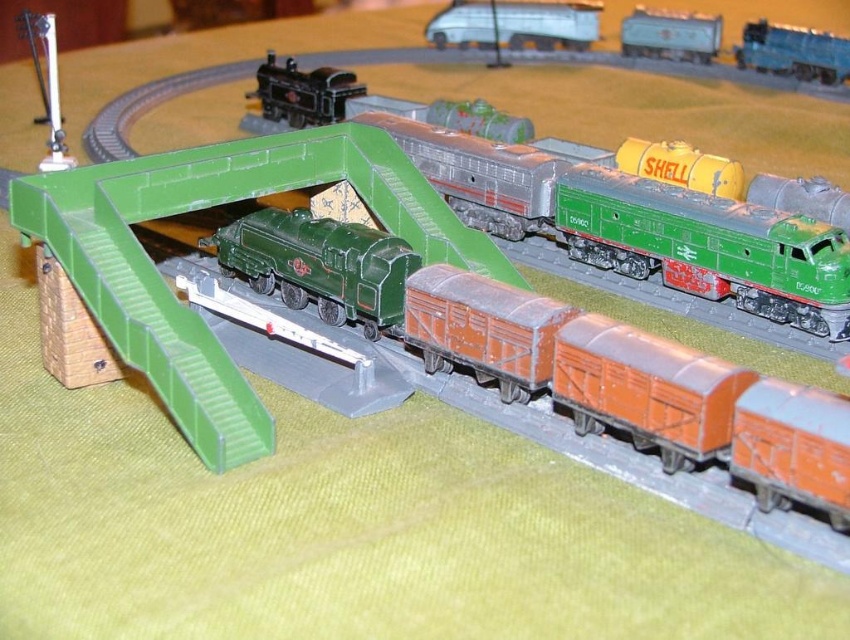
You are a model train enthusiast examining the miniature railway diorama. You notice two points marked on the image. Which point, point (592, 19) or point (756, 32), is closer to you?

Point (592, 19) is closer to you because it is further to the viewer than point (756, 32).

You are a model train enthusiast who wants to place both the green matte train at center and the green matte locomotive at center on a shelf. The shelf has a height limit of 12 inches. Can both items fit on the shelf without exceeding the height restriction?

The green matte train at center is taller than the green matte locomotive at center. Since the shelf has a height limit of 12 inches, both items can fit as long as the tallest item, the green matte train at center, is under 12 inches in height.

You are a model train enthusiast who wants to place a new toy car between the green matte train at center and the green matte locomotive at center in the model railway setup. The toy car is 2.5 inches long. Will there be enough space between them to fit the toy car without overlapping?

The distance between the green matte train at center and the green matte locomotive at center is 3.03 inches. Since the toy car is 2.5 inches long, there is enough space to place it between them without overlapping.